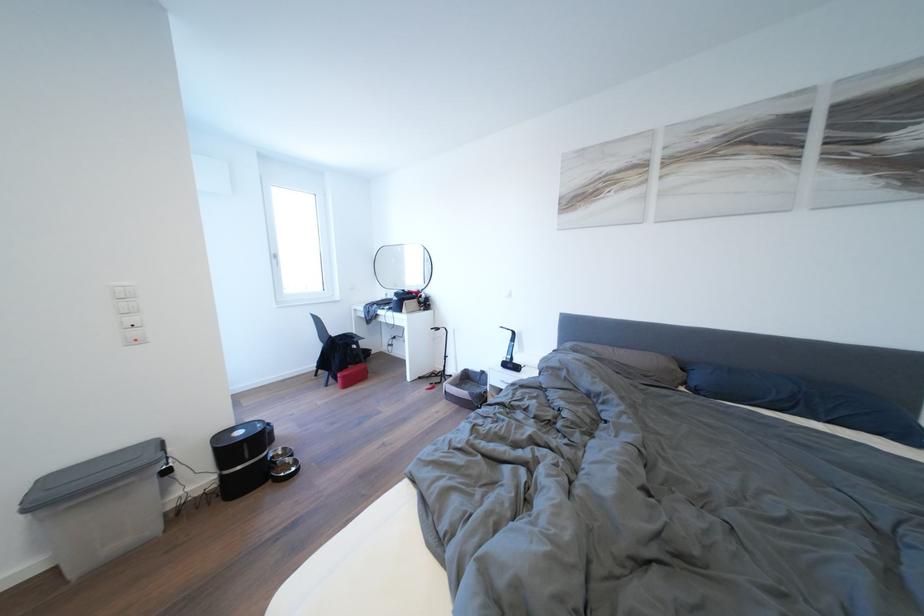
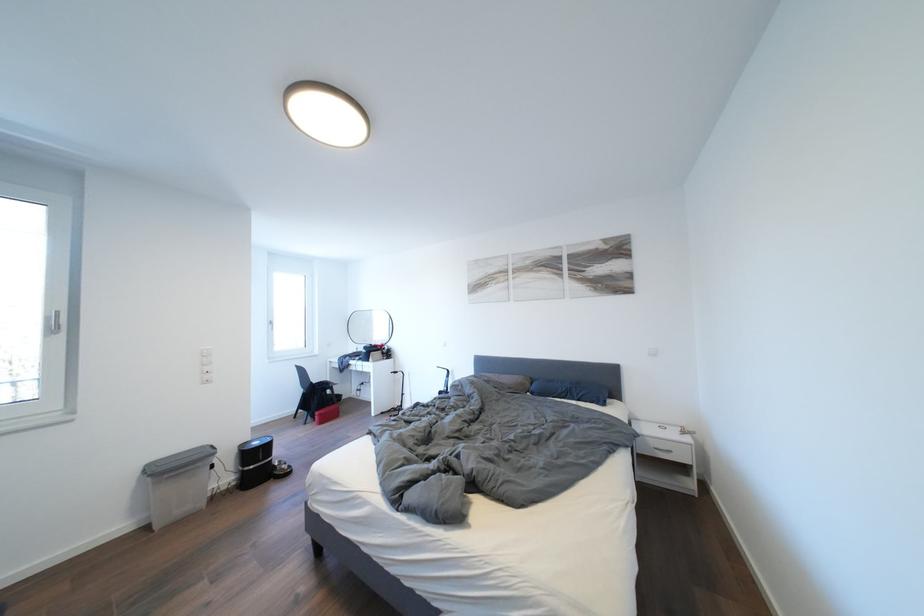
Find the pixel in the second image that matches the point at 704,384 in the first image.

(541, 392)